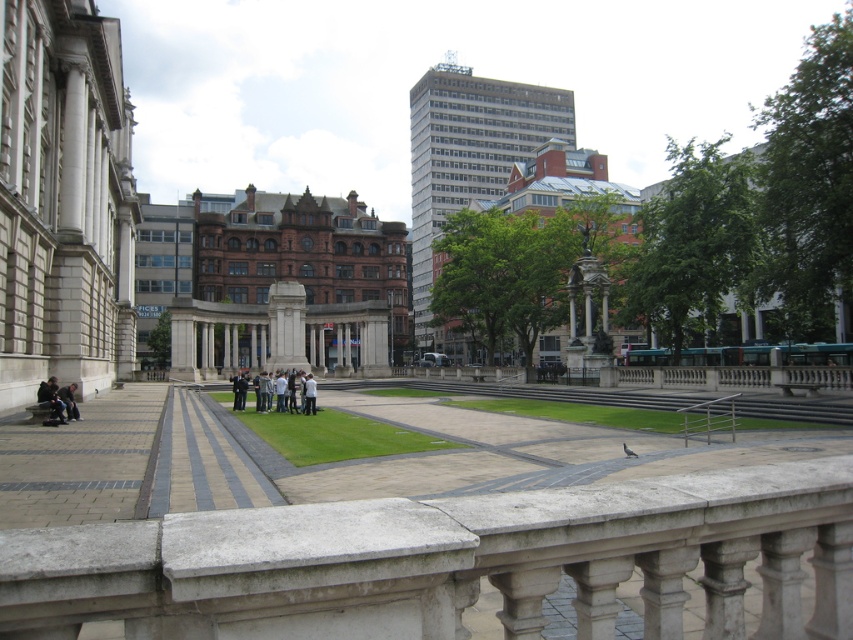
You are a photographer standing in the public square and want to take a photo of the dark gray fabric jacket at lower left without the light gray concrete people at center blocking it. What should you do?

Move to a position where you can see the dark gray fabric jacket at lower left but not the light gray concrete people at center, since the dark gray fabric jacket at lower left is behind the light gray concrete people at center, so moving around them would allow you to capture the jacket without obstruction.

Consider the image. You are a photographer trying to capture a photo of the light gray concrete people at center and the dark gray fabric jacket at lower left in the public square. Which object should you focus on first if you want to ensure both are in sharp focus?

The light gray concrete people at center is much taller than the dark gray fabric jacket at lower left, so you should focus on the light gray concrete people at center first to ensure both are in sharp focus.